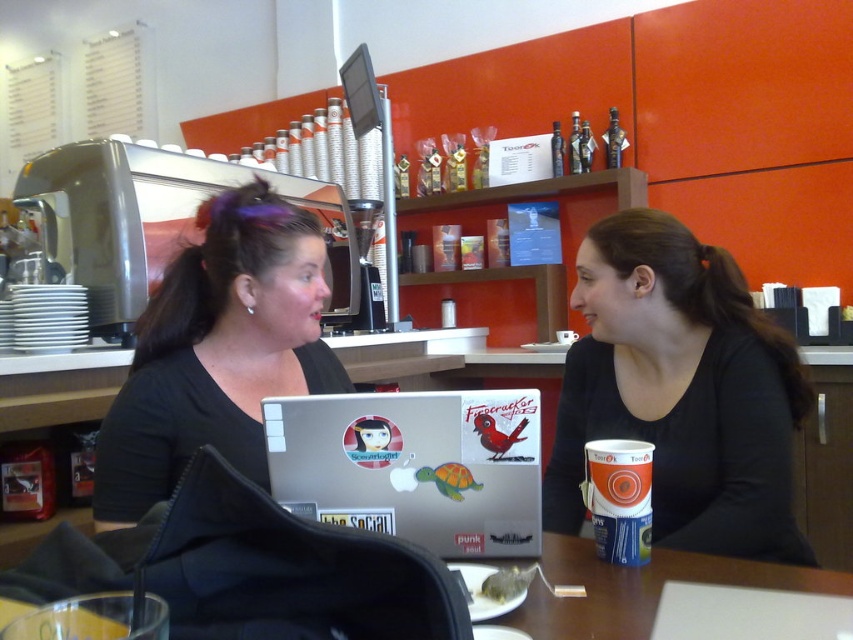
Question: Which point is farther to the camera?

Choices:
 (A) (602, 460)
 (B) (718, 536)

Answer: (B)

Question: Can you confirm if black matte shirt at center is positioned to the right of brown wooden table at lower center?

Choices:
 (A) yes
 (B) no

Answer: (A)

Question: Estimate the real-world distances between objects in this image. Which object is farther from the brown wooden table at lower center?

Choices:
 (A) black matte shirt at center
 (B) orange matte cup at center

Answer: (A)

Question: Does matte black laptop at center appear under brown wooden table at lower center?

Choices:
 (A) yes
 (B) no

Answer: (B)

Question: Which object is farther from the camera taking this photo?

Choices:
 (A) brown wooden table at lower center
 (B) matte black laptop at center
 (C) orange matte cup at center
 (D) black matte shirt at center

Answer: (B)

Question: Does black matte shirt at center appear on the right side of orange matte cup at center?

Choices:
 (A) no
 (B) yes

Answer: (B)